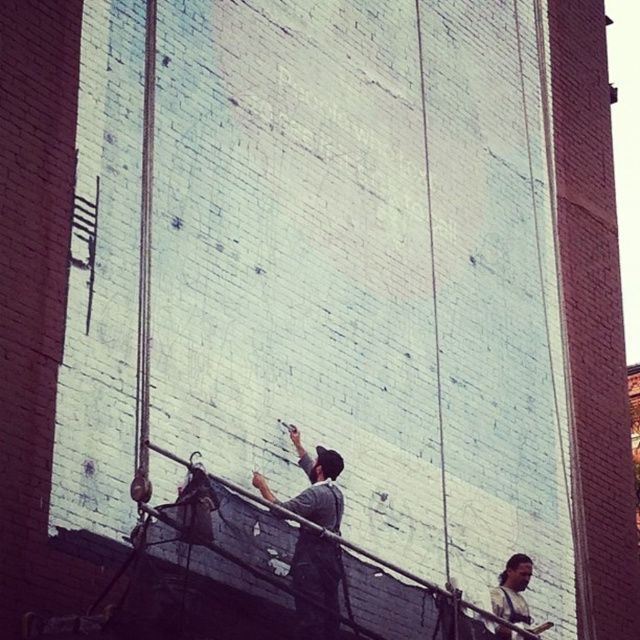
Which is in front, point (326, 484) or point (504, 600)?

Point (326, 484) is in front.

Is dark gray fabric at center to the left of dark brown leather jacket at lower right from the viewer's perspective?

Correct, you'll find dark gray fabric at center to the left of dark brown leather jacket at lower right.

Find the location of a particular element. dark gray fabric at center is located at coordinates click(316, 584).